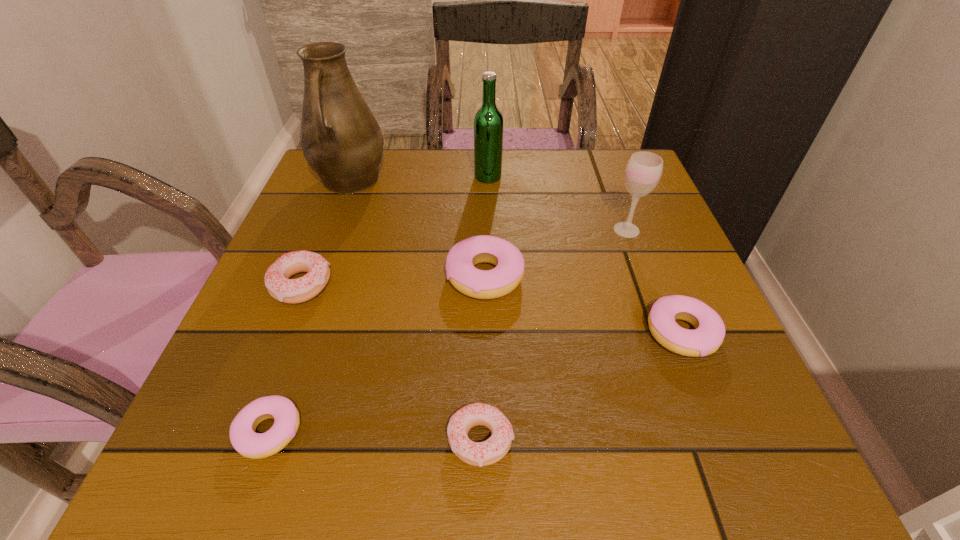
At what (x,y) coordinates should I click in order to perform the action: click on the rightmost doughnut. Please return your answer as a coordinate pair (x, y). The image size is (960, 540). Looking at the image, I should click on (708, 335).

In order to click on the nearer white doughnut in this screenshot , I will do `click(488, 452)`.

Locate an element on the screen. Image resolution: width=960 pixels, height=540 pixels. the right white doughnut is located at coordinates point(488,452).

Locate an element on the screen. This screenshot has height=540, width=960. the smallest pink doughnut is located at coordinates (245, 440).

Where is `the nearest pink doughnut`? The height and width of the screenshot is (540, 960). the nearest pink doughnut is located at coordinates (245, 440).

Locate an element on the screen. Image resolution: width=960 pixels, height=540 pixels. free region located 0.350m on the handle side of the pitcher is located at coordinates (295, 329).

Where is `vacant space located 0.090m on the right of the second tallest object`? The width and height of the screenshot is (960, 540). vacant space located 0.090m on the right of the second tallest object is located at coordinates (538, 177).

This screenshot has height=540, width=960. Find the location of `free space located 0.050m on the left of the third tallest object`. free space located 0.050m on the left of the third tallest object is located at coordinates (588, 230).

Where is `vacant space located 0.260m on the back of the biggest pink doughnut`? vacant space located 0.260m on the back of the biggest pink doughnut is located at coordinates (484, 180).

This screenshot has height=540, width=960. What are the coordinates of `free region located 0.240m on the back of the bigger white doughnut` in the screenshot? It's located at (338, 194).